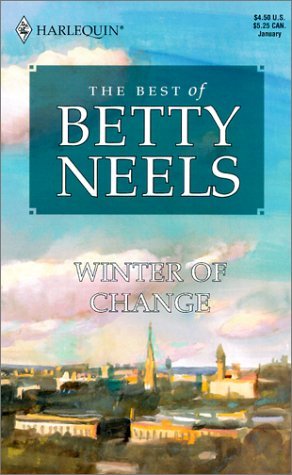
I want to click on windows, so click(137, 433), click(140, 431), click(146, 432), click(162, 432), click(168, 432), click(68, 428), click(61, 426), click(34, 424), click(24, 423).